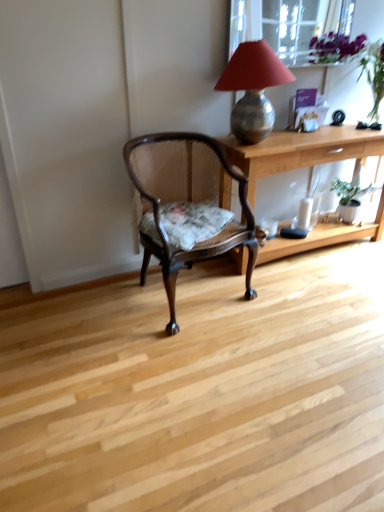
Find the location of a particular element. The width and height of the screenshot is (384, 512). free space on the front side of mahogany cane chair at center is located at coordinates click(183, 358).